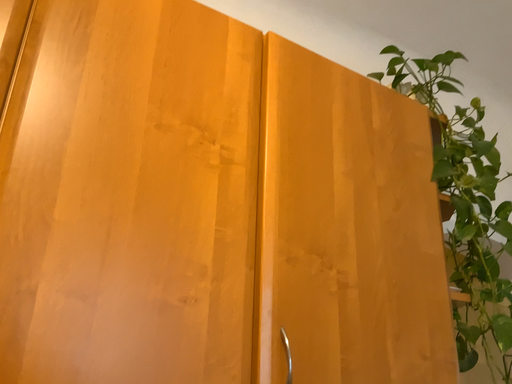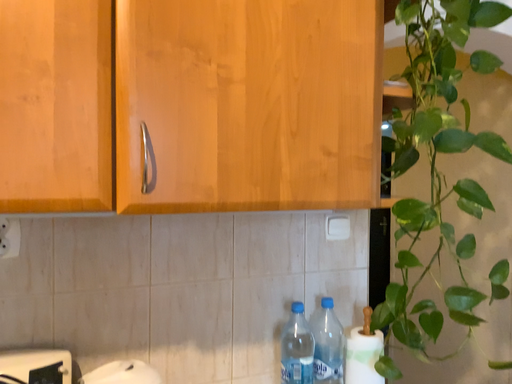
Question: Which way did the camera rotate in the video?

Choices:
 (A) rotated upward
 (B) rotated downward

Answer: (B)